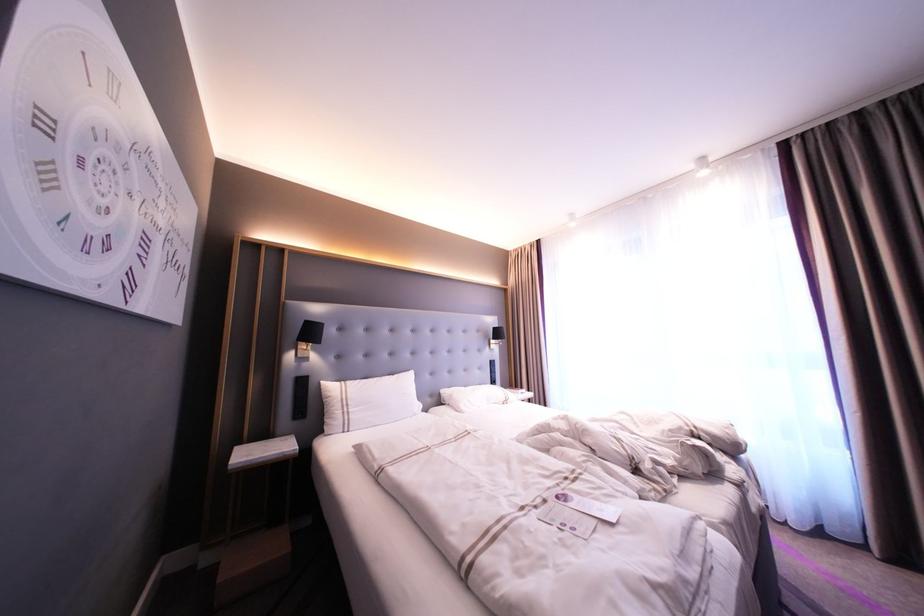
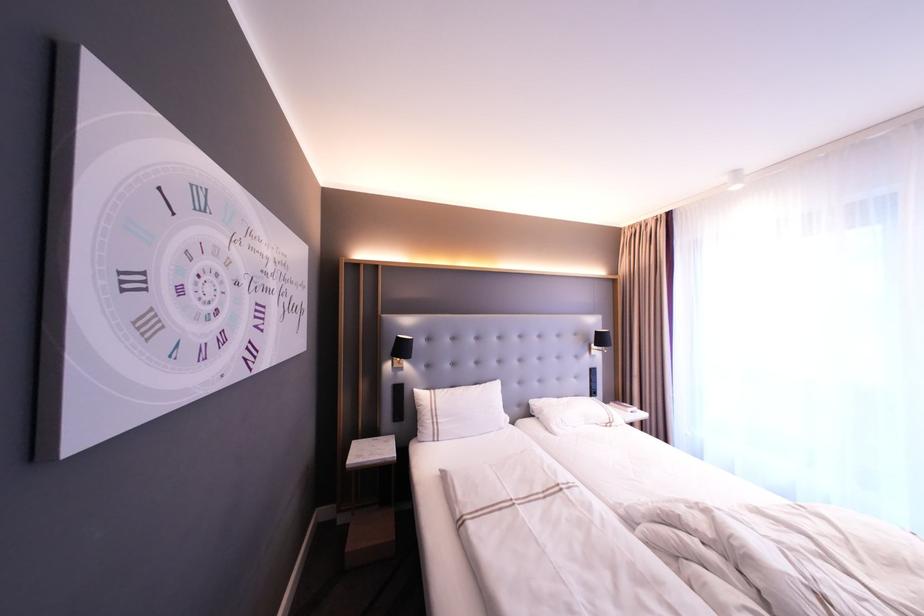
Where in the second image is the point corresponding to point (492, 382) from the first image?

(591, 392)